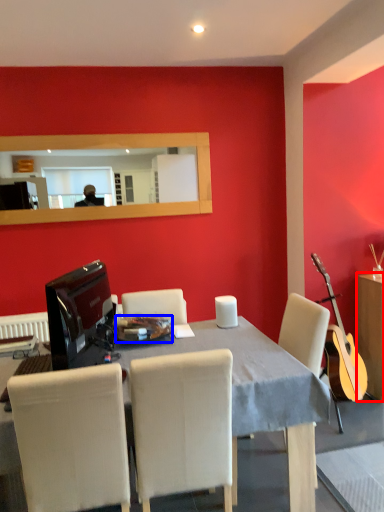
Question: Which point is closer to the camera, cabinetry (highlighted by a red box) or plate (highlighted by a blue box)?

Choices:
 (A) cabinetry
 (B) plate

Answer: (B)